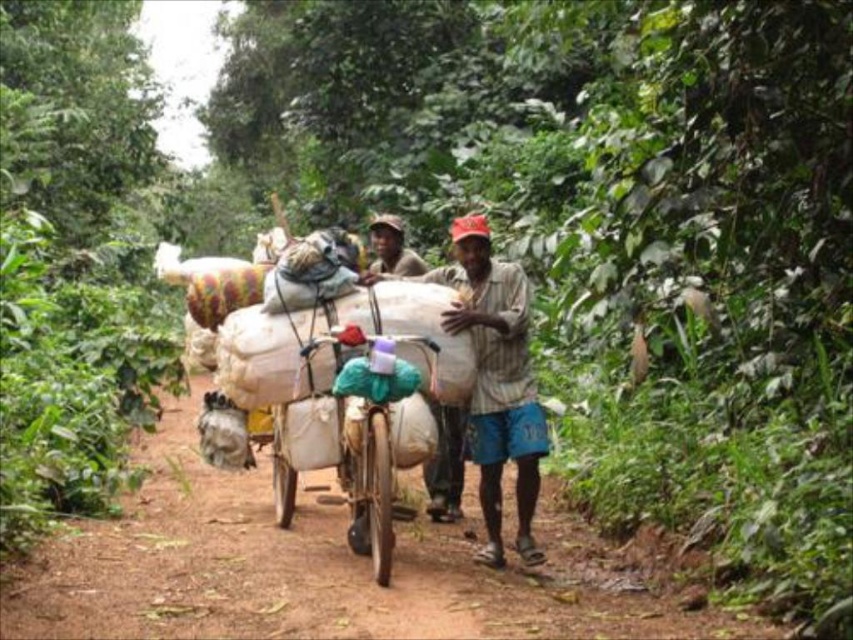
Does brown dirt track at center appear over brown striped shirt at center?

No, brown dirt track at center is not above brown striped shirt at center.

Between brown dirt track at center and brown striped shirt at center, which one is positioned higher?

Positioned higher is brown striped shirt at center.

Locate an element on the screen. The width and height of the screenshot is (853, 640). brown dirt track at center is located at coordinates pyautogui.click(x=318, y=570).

Between brown dirt track at center and matte brown hat at center, which one appears on the right side from the viewer's perspective?

matte brown hat at center is more to the right.

Is point (682, 614) more distant than point (379, 220)?

No, it is not.

Does point (370, 580) lie behind point (421, 266)?

No, it is in front of (421, 266).

The width and height of the screenshot is (853, 640). Identify the location of brown dirt track at center. pyautogui.click(x=318, y=570).

The height and width of the screenshot is (640, 853). I want to click on brown striped shirt at center, so click(x=497, y=380).

Between brown striped shirt at center and matte brown hat at center, which one has more height?

Standing taller between the two is brown striped shirt at center.

Measure the distance between brown striped shirt at center and camera.

7.05 meters

Where is `brown striped shirt at center`? The height and width of the screenshot is (640, 853). brown striped shirt at center is located at coordinates (497, 380).